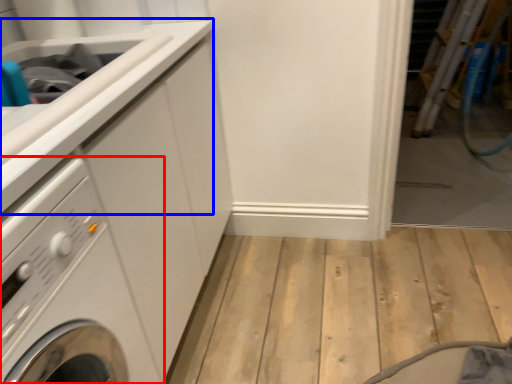
Question: Among these objects, which one is nearest to the camera, washing machine (highlighted by a red box) or counter top (highlighted by a blue box)?

Choices:
 (A) washing machine
 (B) counter top

Answer: (A)